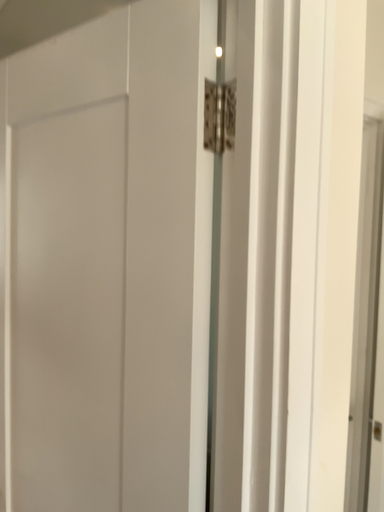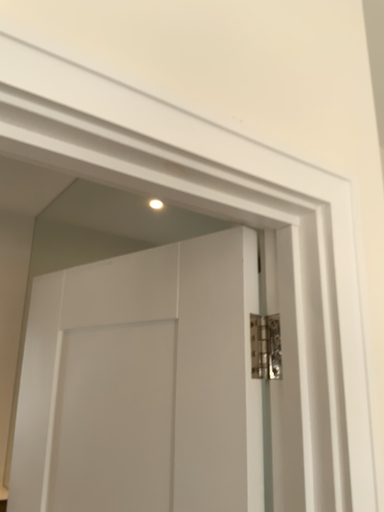
Question: How did the camera likely rotate when shooting the video?

Choices:
 (A) rotated downward
 (B) rotated upward

Answer: (B)